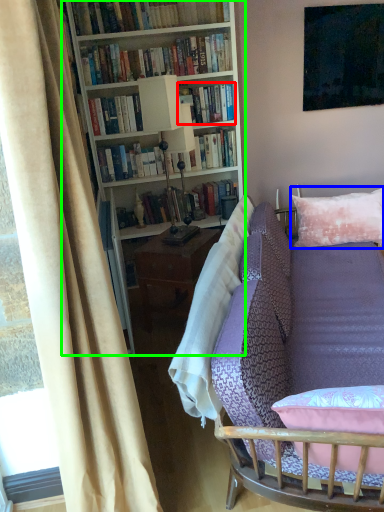
Question: Which object is the farthest from book (highlighted by a red box)? Choose among these: pillow (highlighted by a blue box) or bookcase (highlighted by a green box).

Choices:
 (A) pillow
 (B) bookcase

Answer: (A)